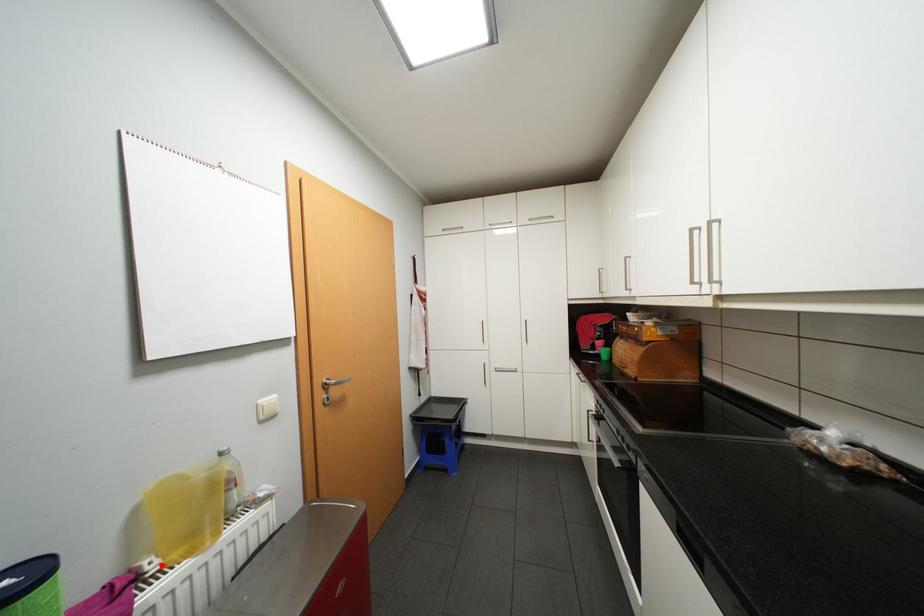
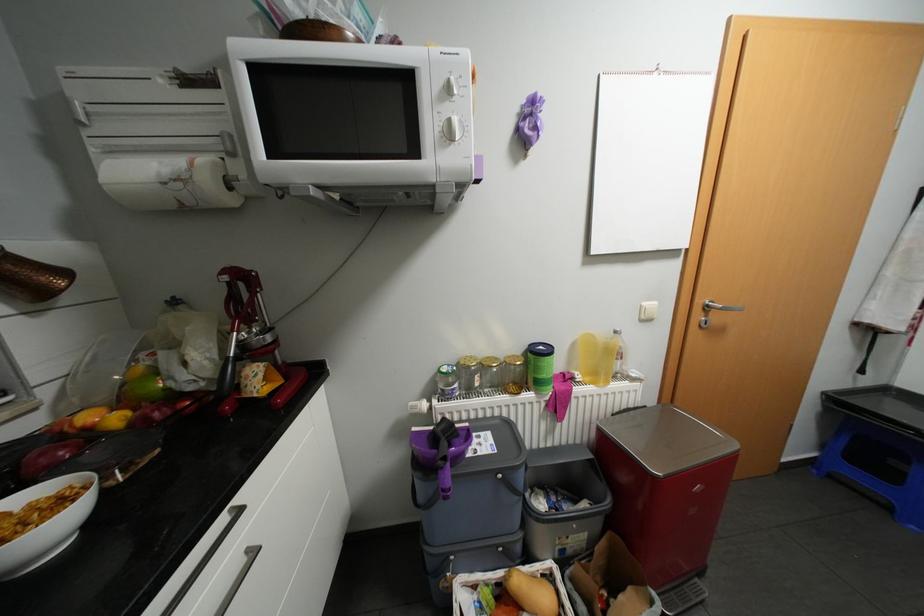
In the second image, find the point that corresponds to the highlighted location in the first image.

(587, 377)